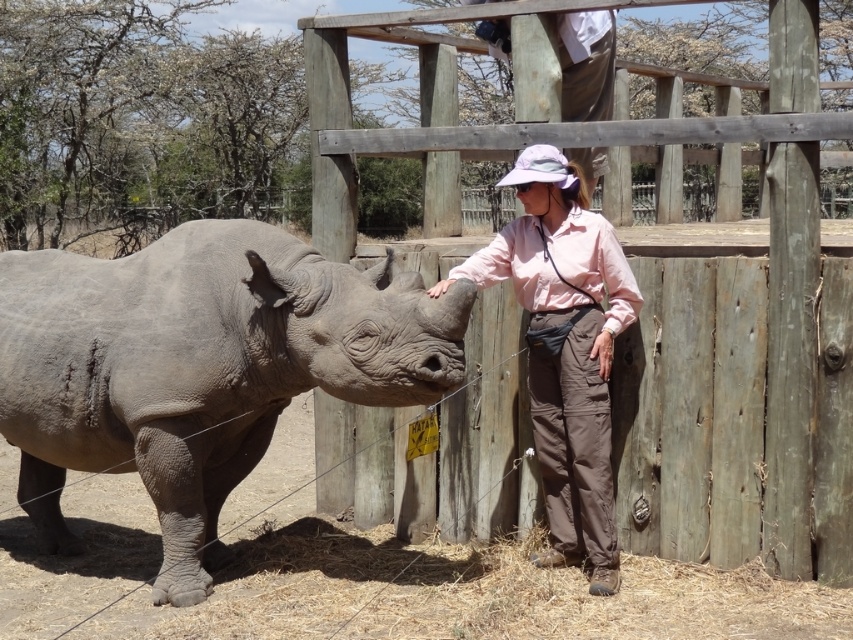
Can you confirm if gray matte rhinoceros at left is thinner than light brown fabric pants at upper center?

No.

Which is in front, point (194, 579) or point (585, 67)?

Point (194, 579) is in front.

This screenshot has width=853, height=640. Identify the location of gray matte rhinoceros at left. (199, 368).

Who is taller, pink fabric shirt at center or light brown fabric pants at upper center?

With more height is pink fabric shirt at center.

Does pink fabric shirt at center come in front of light brown fabric pants at upper center?

Yes, it is in front of light brown fabric pants at upper center.

Measure the distance between pink fabric shirt at center and camera.

pink fabric shirt at center and camera are 16.94 feet apart from each other.

You are a GUI agent. You are given a task and a screenshot of the screen. Output one action in this format:
    pyautogui.click(x=<x>, y=<y>)
    Task: Click on the pink fabric shirt at center
    This screenshot has height=640, width=853.
    Given the screenshot: What is the action you would take?
    pyautogui.click(x=564, y=348)

Which of these two, gray matte rhinoceros at left or pink fabric shirt at center, stands shorter?

With less height is gray matte rhinoceros at left.

Can you confirm if gray matte rhinoceros at left is positioned above pink fabric shirt at center?

No.

Which is behind, point (155, 369) or point (585, 381)?

Positioned behind is point (585, 381).

Where is `gray matte rhinoceros at left`? This screenshot has width=853, height=640. gray matte rhinoceros at left is located at coordinates (199, 368).